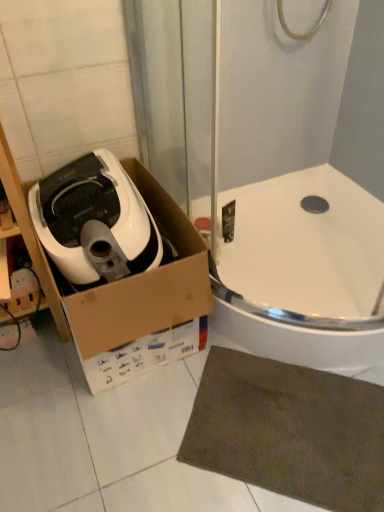
The height and width of the screenshot is (512, 384). I want to click on free space in front of white cardboard box at left, so click(100, 437).